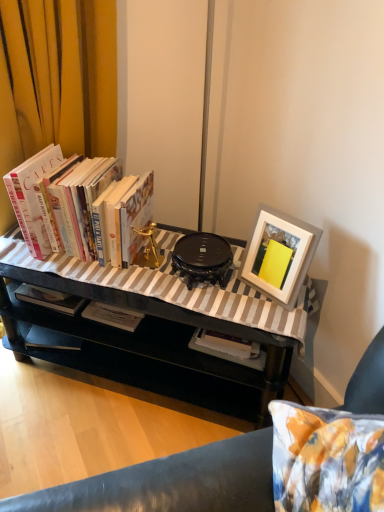
Locate an element on the screen. The width and height of the screenshot is (384, 512). free space in front of white matte picture frame at upper right is located at coordinates (270, 315).